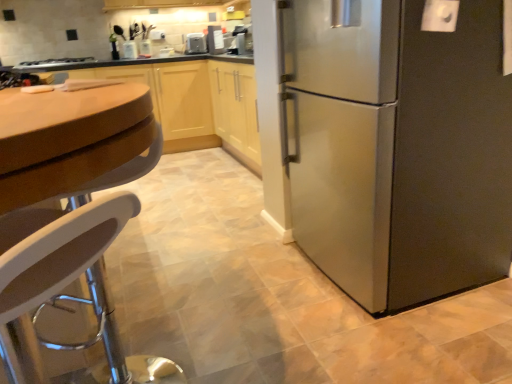
Image resolution: width=512 pixels, height=384 pixels. In order to click on free space in front of satin silver refrigerator at right in this screenshot , I will do `click(403, 339)`.